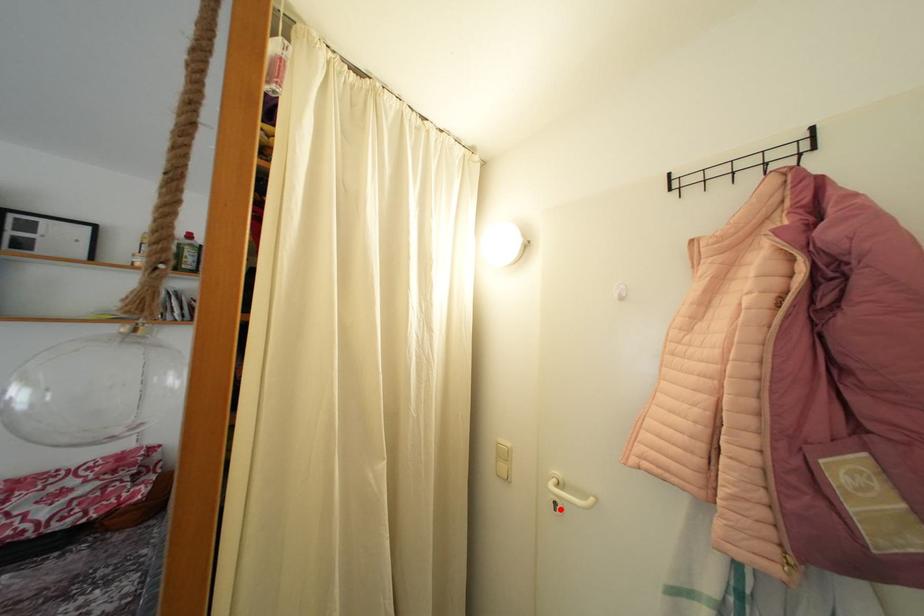
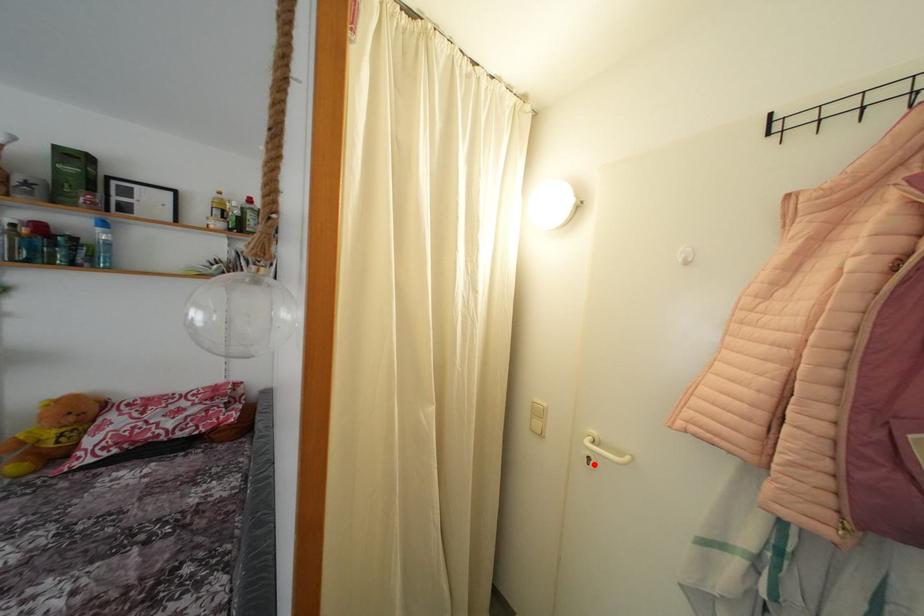
I am providing you with two images of the same scene from different viewpoints. A red point is marked on the first image and another point is marked on the second image. Does the point marked in image1 correspond to the same location as the one in image2?

Yes